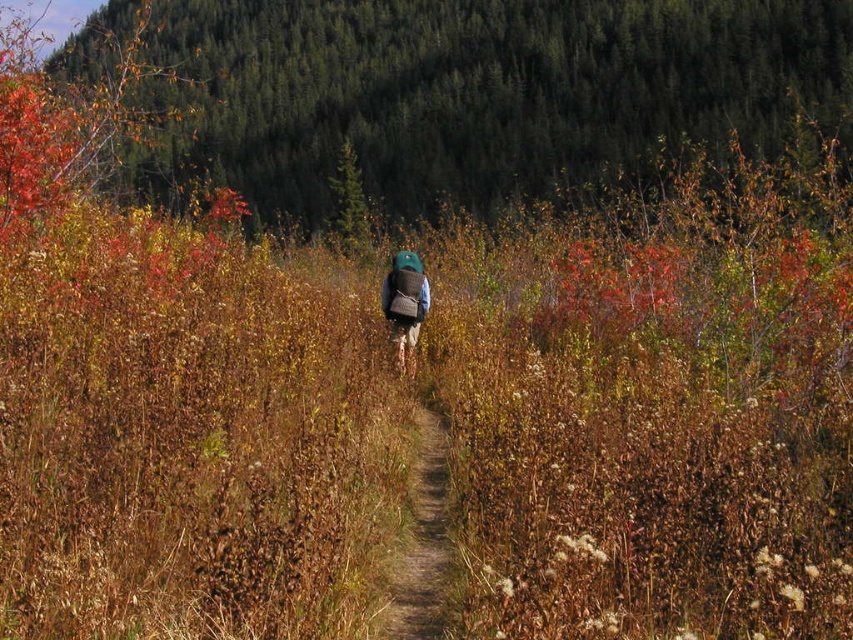
Can you confirm if green textured foliage at upper center is positioned below brown dirt path at center?

No, green textured foliage at upper center is not below brown dirt path at center.

Locate an element on the screen. The image size is (853, 640). green textured foliage at upper center is located at coordinates (469, 92).

Between point (286, 150) and point (422, 468), which one is positioned behind?

The point (286, 150) is more distant.

Where is `green textured foliage at upper center`? This screenshot has height=640, width=853. green textured foliage at upper center is located at coordinates (469, 92).

Which of these two, brown dirt path at center or matte green backpack at center, stands taller?

With more height is matte green backpack at center.

Can you confirm if brown dirt path at center is bigger than matte green backpack at center?

Actually, brown dirt path at center might be smaller than matte green backpack at center.

Which is in front, point (416, 461) or point (408, 326)?

Positioned in front is point (416, 461).

At what (x,y) coordinates should I click in order to perform the action: click on brown dirt path at center. Please return your answer as a coordinate pair (x, y). Looking at the image, I should click on (422, 536).

Is green textured foliage at upper center thinner than matte green backpack at center?

Incorrect, green textured foliage at upper center's width is not less than matte green backpack at center's.

Between green textured foliage at upper center and matte green backpack at center, which one appears on the right side from the viewer's perspective?

matte green backpack at center

Who is more distant from viewer, (267,136) or (405,323)?

The point (267,136) is behind.

Where is `green textured foliage at upper center`? The height and width of the screenshot is (640, 853). green textured foliage at upper center is located at coordinates (469, 92).